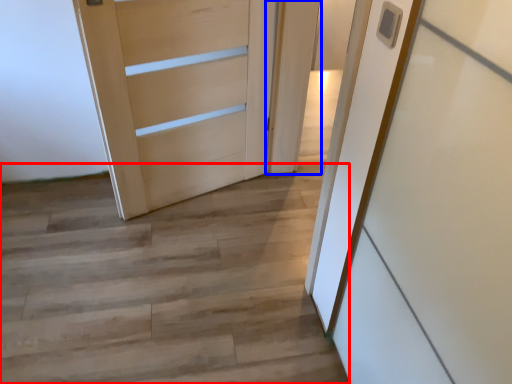
Question: Which point is further to the camera, stairwell (highlighted by a red box) or door (highlighted by a blue box)?

Choices:
 (A) stairwell
 (B) door

Answer: (B)